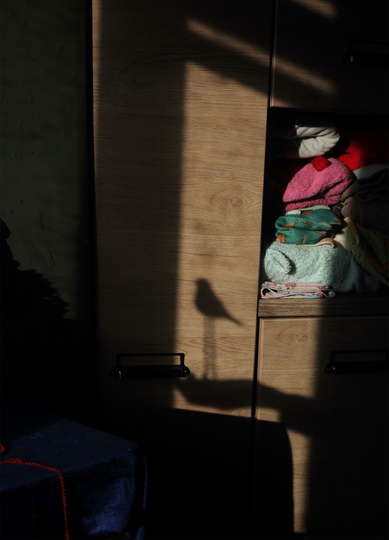
Find the location of a particular element. Image resolution: width=389 pixels, height=540 pixels. handle on dresser is located at coordinates (347, 370).